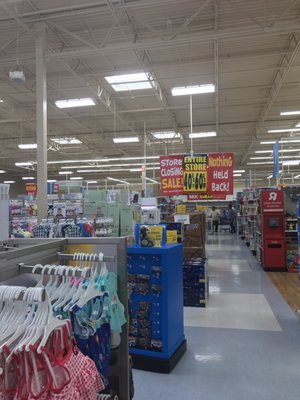
At what (x,y) coordinates should I click in order to perform the action: click on gray part of tiled floor. Please return your answer as a coordinate pair (x, y). The width and height of the screenshot is (300, 400). Looking at the image, I should click on (270, 356).